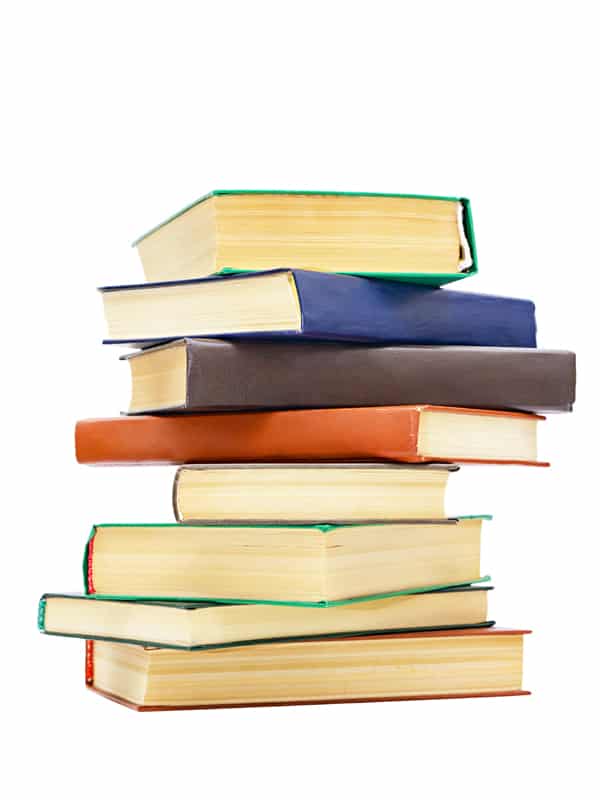
You are a GUI agent. You are given a task and a screenshot of the screen. Output one action in this format:
    pyautogui.click(x=<x>, y=<y>)
    Task: Click on the books
    
    Given the screenshot: What is the action you would take?
    pyautogui.click(x=348, y=242), pyautogui.click(x=331, y=310), pyautogui.click(x=321, y=374), pyautogui.click(x=336, y=441), pyautogui.click(x=328, y=494), pyautogui.click(x=318, y=570), pyautogui.click(x=154, y=620), pyautogui.click(x=208, y=674)